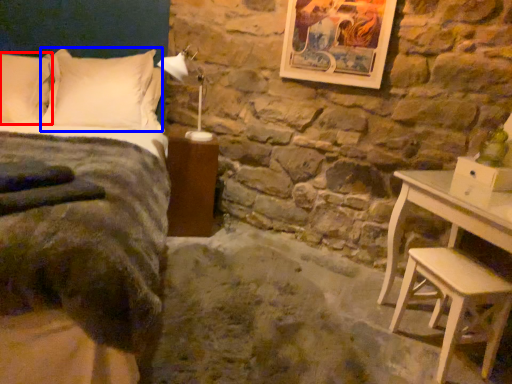
Question: Which point is further to the camera, pillow (highlighted by a red box) or pillow (highlighted by a blue box)?

Choices:
 (A) pillow
 (B) pillow

Answer: (B)